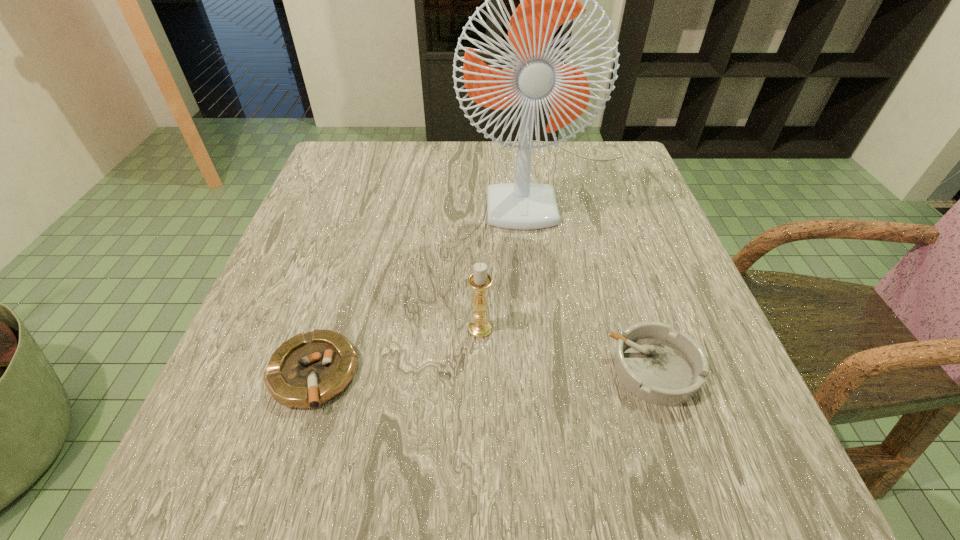
Image resolution: width=960 pixels, height=540 pixels. I want to click on object situated at the far edge, so click(547, 0).

I want to click on object positioned at the left edge, so click(x=310, y=369).

Identify the location of fan present at the right edge. (547, 0).

Where is `ashtray that is at the right edge`? ashtray that is at the right edge is located at coordinates (658, 366).

Image resolution: width=960 pixels, height=540 pixels. I want to click on object that is at the far right corner, so click(547, 0).

Find the location of a particular element. vacant space at the far edge of the desktop is located at coordinates (559, 153).

The image size is (960, 540). In the image, there is a desktop. Identify the location of vacant space at the near edge. (583, 511).

Locate an element on the screen. vacant space at the left edge of the desktop is located at coordinates (368, 210).

Locate an element on the screen. vacant space at the right edge of the desktop is located at coordinates (650, 221).

Locate an element on the screen. This screenshot has width=960, height=540. free point at the far left corner is located at coordinates (330, 177).